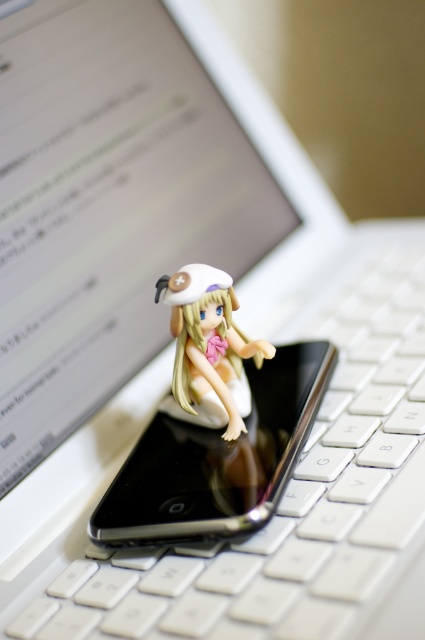
Question: Which point is closer to the camera taking this photo?

Choices:
 (A) (116, 547)
 (B) (192, 312)

Answer: (A)

Question: Observing the image, what is the correct spatial positioning of black glossy smartphone at center in reference to matte white figurine at center?

Choices:
 (A) right
 (B) left

Answer: (A)

Question: Does black glossy smartphone at center have a larger size compared to matte white figurine at center?

Choices:
 (A) no
 (B) yes

Answer: (B)

Question: Which point is closer to the camera?

Choices:
 (A) (291, 344)
 (B) (268, 356)

Answer: (B)

Question: Considering the relative positions of black glossy smartphone at center and matte white figurine at center in the image provided, where is black glossy smartphone at center located with respect to matte white figurine at center?

Choices:
 (A) above
 (B) below

Answer: (B)